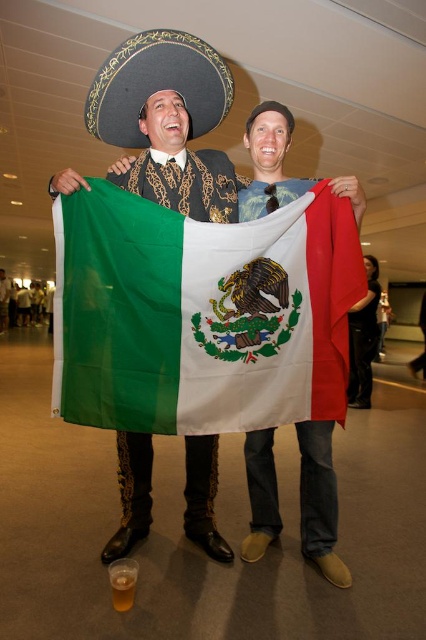
Who is taller, polyester mexican flag at center or black leather pants at lower right?

With more height is black leather pants at lower right.

Image resolution: width=426 pixels, height=640 pixels. I want to click on polyester mexican flag at center, so click(x=201, y=314).

Find the location of a particular element. This screenshot has height=640, width=426. polyester mexican flag at center is located at coordinates (201, 314).

Based on the photo, how far apart are matte white flag at center and translucent plastic cup at lower left?

matte white flag at center is 33.52 inches from translucent plastic cup at lower left.

Between matte white flag at center and translucent plastic cup at lower left, which one appears on the right side from the viewer's perspective?

matte white flag at center is more to the right.

Who is more distant from viewer, (255, 513) or (114, 602)?

The point (255, 513) is more distant.

Image resolution: width=426 pixels, height=640 pixels. What are the coordinates of `matte white flag at center` in the screenshot? It's located at (319, 500).

I want to click on matte green flag at center, so [319, 500].

Is matte green flag at center closer to the viewer compared to translucent plastic cup at lower left?

No.

You are a GUI agent. You are given a task and a screenshot of the screen. Output one action in this format:
    pyautogui.click(x=<x>, y=<y>)
    Task: Click on the matte green flag at center
    The width and height of the screenshot is (426, 640).
    Given the screenshot: What is the action you would take?
    pyautogui.click(x=319, y=500)